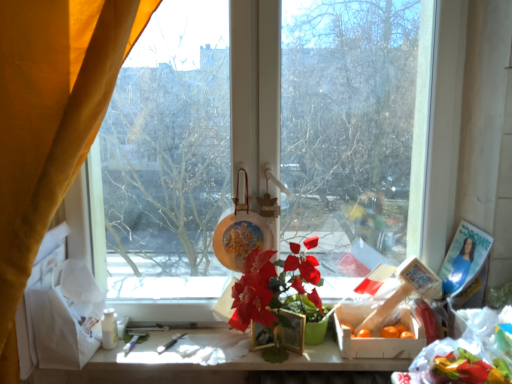
Locate an element on the screen. vacant region above white matte table at center (from a real-world perspective) is located at coordinates (202, 342).